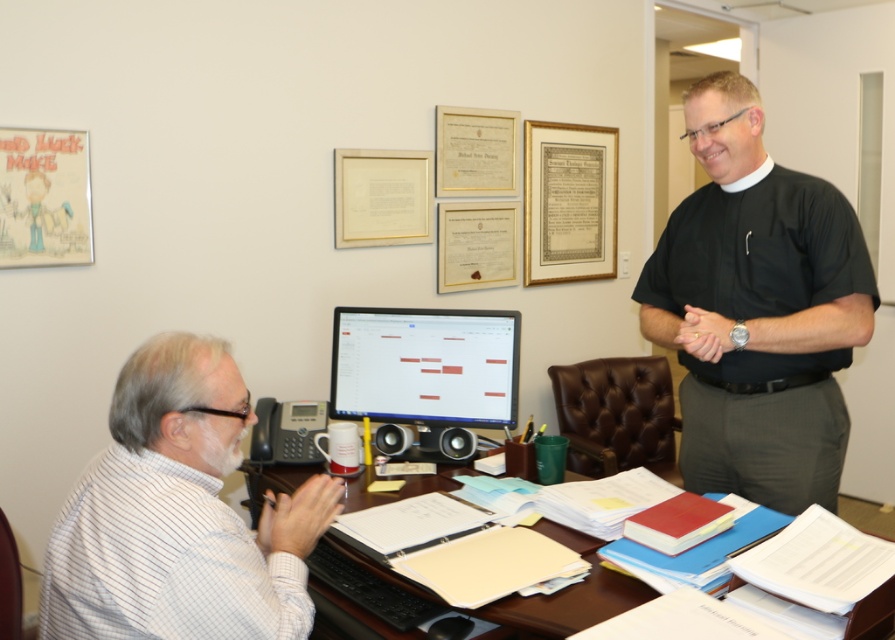
Does white striped shirt at left appear on the left side of matte black monitor at center?

Correct, you'll find white striped shirt at left to the left of matte black monitor at center.

Does white striped shirt at left have a greater height compared to matte black monitor at center?

Correct, white striped shirt at left is much taller as matte black monitor at center.

Where is `white striped shirt at left`? white striped shirt at left is located at coordinates (179, 515).

Is point (793, 346) farther from camera compared to point (459, 404)?

That is False.

Is black matte shirt at right bigger than matte black monitor at center?

Correct, black matte shirt at right is larger in size than matte black monitor at center.

Between point (688, 113) and point (376, 374), which one is positioned in front?

Point (688, 113)

Identify the location of black matte shirt at right. Image resolution: width=895 pixels, height=640 pixels. (757, 308).

Between point (836, 365) and point (210, 493), which one is positioned in front?

Point (210, 493)

Which is below, black matte shirt at right or white striped shirt at left?

white striped shirt at left

The width and height of the screenshot is (895, 640). Describe the element at coordinates (757, 308) in the screenshot. I see `black matte shirt at right` at that location.

At what (x,y) coordinates should I click in order to perform the action: click on black matte shirt at right. Please return your answer as a coordinate pair (x, y). Looking at the image, I should click on (757, 308).